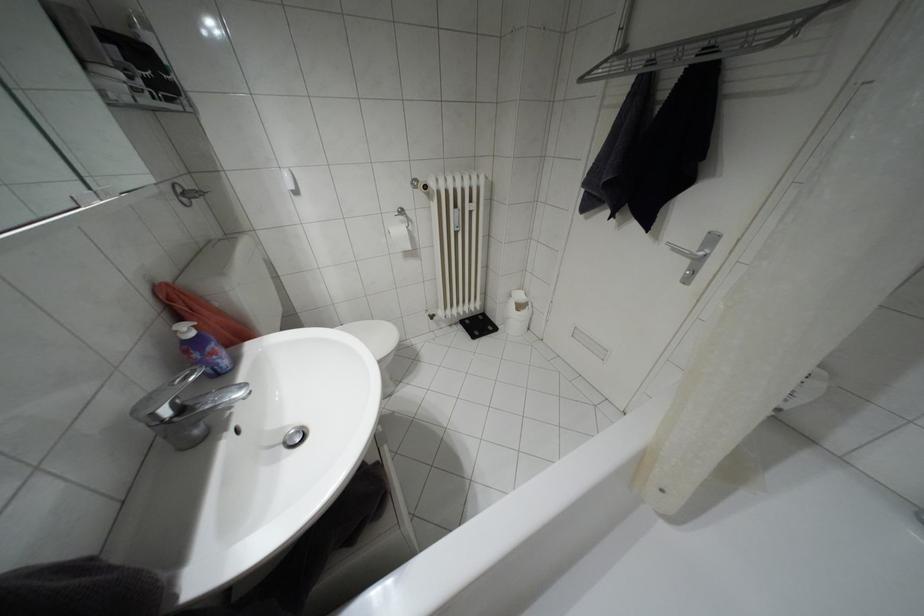
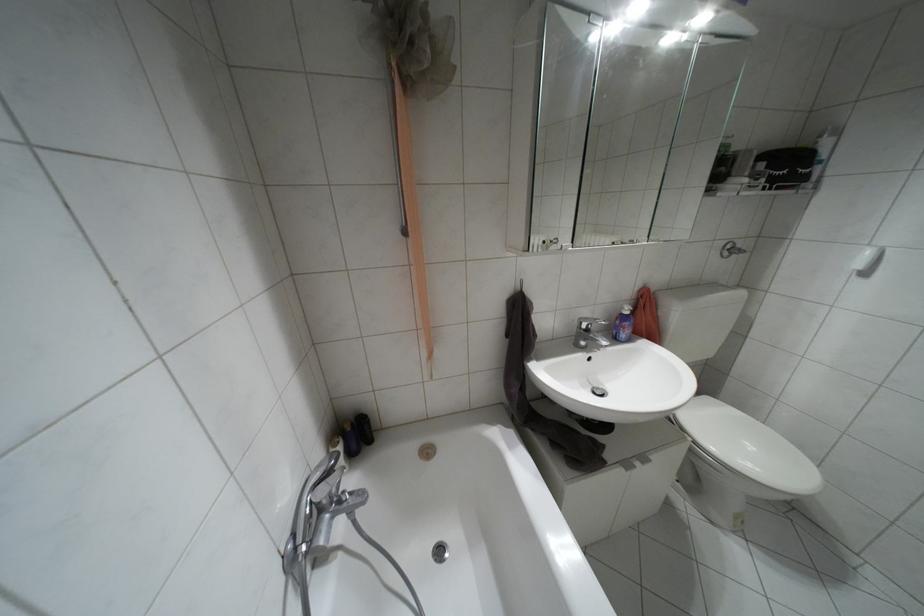
In the second image, find the point that corresponds to (x=190, y=333) in the first image.

(626, 312)